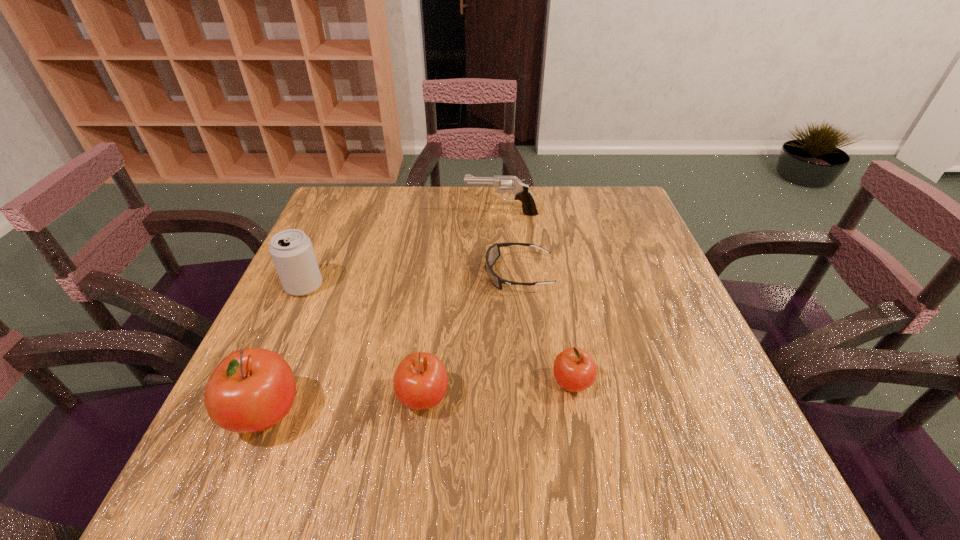
This screenshot has height=540, width=960. Find the location of `free spot located on the left of the shortest apple`. free spot located on the left of the shortest apple is located at coordinates (435, 383).

The height and width of the screenshot is (540, 960). Identify the location of vacant area located 0.170m at the muzzle of the farthest object. (405, 213).

Identify the location of vacant area situated at the muzzle of the farthest object. Image resolution: width=960 pixels, height=540 pixels. (339, 213).

Locate an element on the screen. vacant area situated at the muzzle of the farthest object is located at coordinates click(343, 213).

Find the location of a particular element. Image resolution: width=960 pixels, height=540 pixels. vacant area situated on the lenses of the goggles is located at coordinates (402, 274).

I want to click on free region located on the lenses of the goggles, so click(x=336, y=274).

Find the location of a particular element. The height and width of the screenshot is (540, 960). free space located 0.070m on the lenses of the goggles is located at coordinates (456, 274).

The width and height of the screenshot is (960, 540). Find the location of `free space located on the back of the can`. free space located on the back of the can is located at coordinates (334, 219).

Identify the location of object located at the far edge. This screenshot has height=540, width=960. (521, 191).

Locate an element on the screen. The image size is (960, 540). apple that is at the left edge is located at coordinates (252, 389).